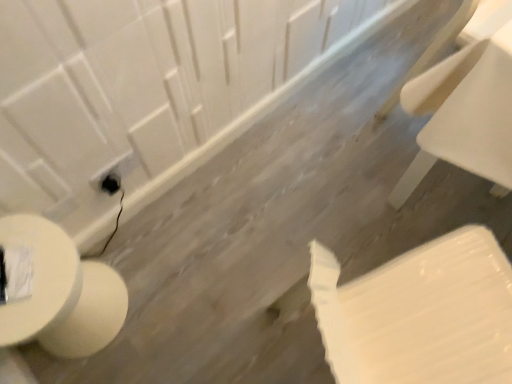
Where is `vacant space that is to the left of white plastic chair at upper right`? vacant space that is to the left of white plastic chair at upper right is located at coordinates (334, 118).